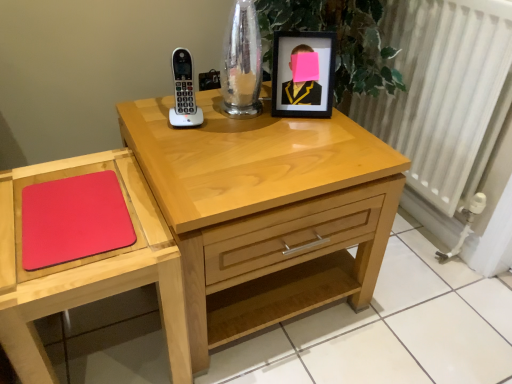
This screenshot has height=384, width=512. What are the coordinates of `free spot above rubberized red mousepad at lower left (from a real-world perspective)` in the screenshot? It's located at (75, 205).